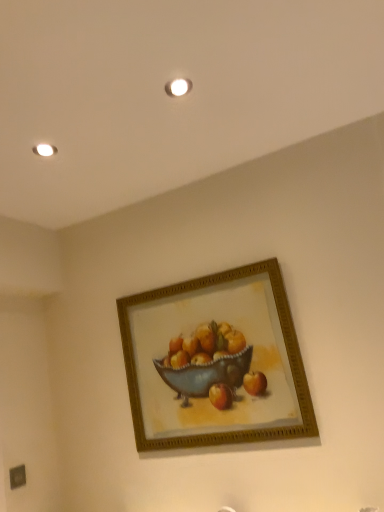
Measure the distance between gold/gilded picture frame at center and camera.

gold/gilded picture frame at center and camera are 5.58 feet apart.

You are a GUI agent. You are given a task and a screenshot of the screen. Output one action in this format:
    pyautogui.click(x=<x>, y=<y>)
    Task: Click on the gold/gilded picture frame at center
    The image size is (384, 512).
    Given the screenshot: What is the action you would take?
    pyautogui.click(x=215, y=361)

This screenshot has width=384, height=512. Describe the element at coordinates (215, 361) in the screenshot. I see `gold/gilded picture frame at center` at that location.

At what (x,y) coordinates should I click in order to perform the action: click on gold/gilded picture frame at center. Please return your answer as a coordinate pair (x, y). The height and width of the screenshot is (512, 384). Looking at the image, I should click on (215, 361).